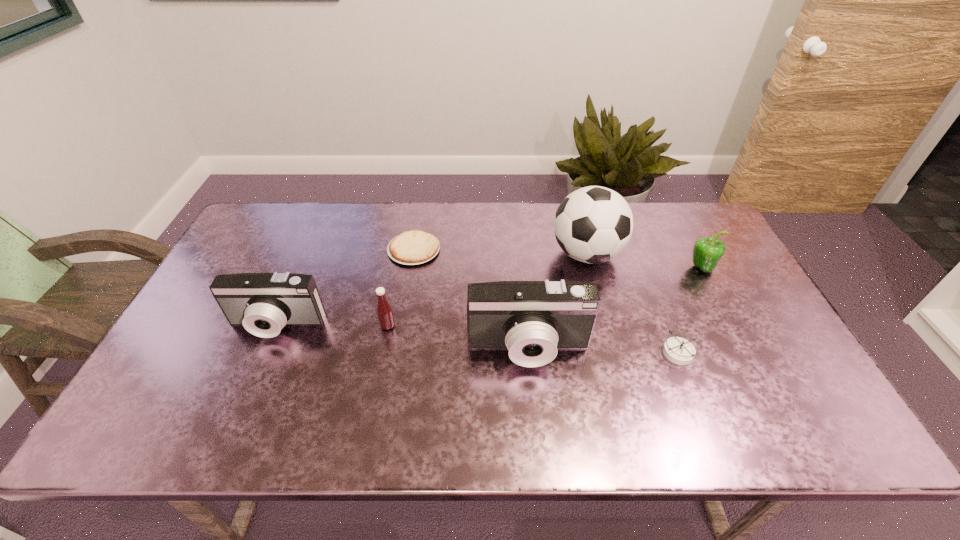
At what (x,y) coordinates should I click in order to perform the action: click on object at the right edge. Please return your answer as a coordinate pair (x, y). Image resolution: width=960 pixels, height=540 pixels. Looking at the image, I should click on [x=707, y=252].

I want to click on vacant space at the far edge of the desktop, so click(x=458, y=219).

Find the location of `free space at the near edge of the desktop`. free space at the near edge of the desktop is located at coordinates (684, 373).

In the image, there is a desktop. Identify the location of vacant area at the left edge. (198, 357).

Identify the location of free region at the far left corner of the desktop. The width and height of the screenshot is (960, 540). (287, 213).

The width and height of the screenshot is (960, 540). In order to click on vacant region at the near left corner of the desktop in this screenshot , I will do `click(181, 375)`.

Find the location of a particular element. The image size is (960, 540). free space at the far right corner of the desktop is located at coordinates (689, 207).

Where is `empty location between the right camcorder and the rightmost object`? empty location between the right camcorder and the rightmost object is located at coordinates (615, 308).

I want to click on free point between the bell pepper and the shortest object, so click(558, 259).

Find the location of a particular element. The height and width of the screenshot is (540, 960). free area in between the tallest object and the sixth object from left to right is located at coordinates (632, 303).